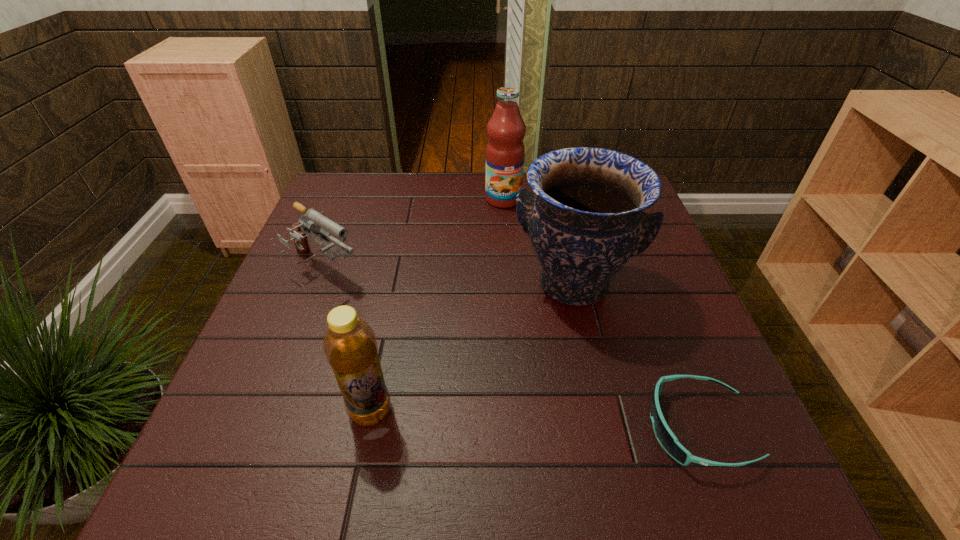
Where is `vacant space located 0.130m on the front label of the fruit juice`? The height and width of the screenshot is (540, 960). vacant space located 0.130m on the front label of the fruit juice is located at coordinates (511, 236).

Locate an element on the screen. This screenshot has height=540, width=960. vacant space located 0.250m on the front label of the fruit juice is located at coordinates (517, 265).

The height and width of the screenshot is (540, 960). In order to click on vacant space situated 0.120m on the front label of the fruit juice in this screenshot , I will do `click(511, 234)`.

At what (x,y) coordinates should I click in order to perform the action: click on free location located 0.130m at the barrel end of the gun. Please return your answer as a coordinate pair (x, y). Looking at the image, I should click on (387, 312).

This screenshot has width=960, height=540. What are the coordinates of `free space located 0.150m at the barrel end of the gun` in the screenshot? It's located at (393, 316).

Locate an element on the screen. The height and width of the screenshot is (540, 960). blank space located 0.390m at the barrel end of the gun is located at coordinates (474, 372).

You are a GUI agent. You are given a task and a screenshot of the screen. Output one action in this format:
    pyautogui.click(x=<x>, y=<y>)
    Task: Click on the free space located 0.220m on the front handle of the pottery
    
    Given the screenshot: What is the action you would take?
    pyautogui.click(x=559, y=412)

Where is `vacant region located on the front handle of the pottery`? The height and width of the screenshot is (540, 960). vacant region located on the front handle of the pottery is located at coordinates (556, 431).

The width and height of the screenshot is (960, 540). What are the coordinates of `vacant space located 0.250m on the front handle of the pottery` in the screenshot? It's located at (557, 427).

In order to click on object present at the far edge in this screenshot , I will do `click(505, 152)`.